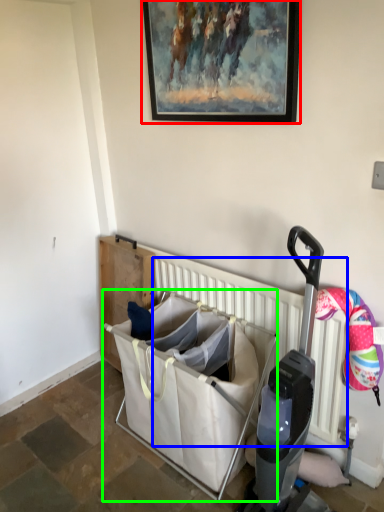
Question: Which object is positioned farthest from picture frame (highlighted by a red box)? Select from radiator (highlighted by a blue box) and baby carriage (highlighted by a green box).

Choices:
 (A) radiator
 (B) baby carriage

Answer: (B)